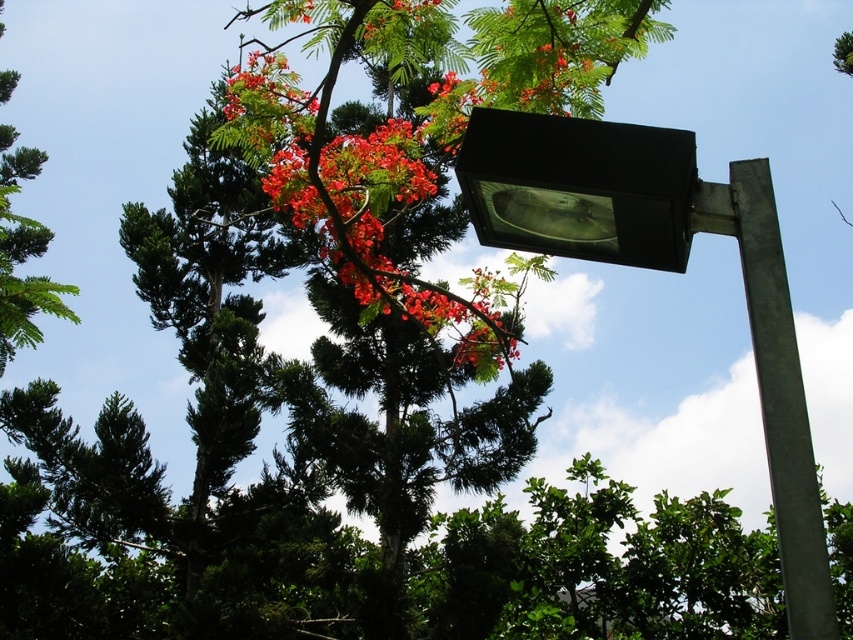
Does point (561, 200) come in front of point (3, 198)?

Yes.

Identify the location of black matte streetlight at upper right. (663, 269).

Which is below, black plastic lamp at upper right or green leafy tree at upper left?

Positioned lower is green leafy tree at upper left.

Does point (473, 141) come farther from viewer compared to point (4, 296)?

No, (473, 141) is in front of (4, 296).

Find the location of a particular element. The height and width of the screenshot is (640, 853). black plastic lamp at upper right is located at coordinates (578, 186).

At what (x,y) coordinates should I click in order to perform the action: click on black plastic lamp at upper right. Please return your answer as a coordinate pair (x, y). The height and width of the screenshot is (640, 853). Looking at the image, I should click on pos(578,186).

Describe the element at coordinates (663, 269) in the screenshot. I see `black matte streetlight at upper right` at that location.

Does black matte streetlight at upper right appear on the left side of green concrete pole at center?

Yes, black matte streetlight at upper right is to the left of green concrete pole at center.

Where is `black matte streetlight at upper right`? black matte streetlight at upper right is located at coordinates (663, 269).